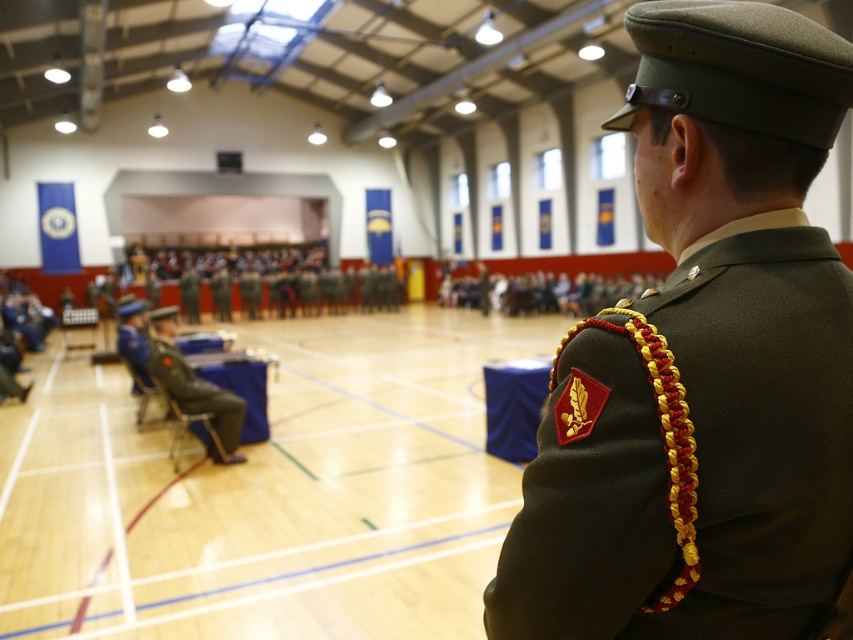
You are a photographer positioned at the back of the gymnasium and need to capture a clear photo of both the matte green uniform at center and the green military uniform at center. Which uniform will appear narrower in the photo?

The matte green uniform at center will appear narrower in the photo because it is thinner than the green military uniform at center.

You are a photographer at the ceremony and need to capture a clear photo of the matte green uniform at center and the green military uniform at center. Which one is covering the other?

The matte green uniform at center is positioned over green military uniform at center, meaning it is covering the latter.

Looking at this image, you are a photographer positioned at the back of the gymnasium and need to capture a clear photo of both the matte green uniform at center and the green military uniform at center. Considering their heights, which uniform might block the view of the other?

The matte green uniform at center is shorter than the green military uniform at center, so the shorter matte green uniform at center might block the view of the taller green military uniform at center if positioned in front.